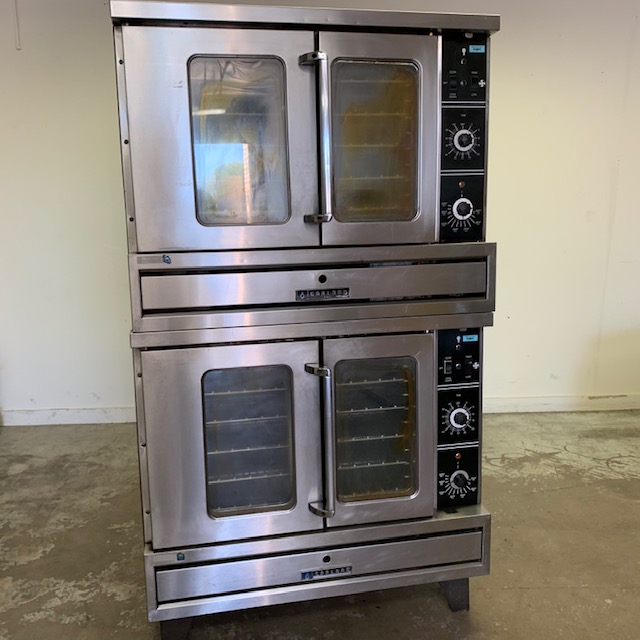
Find the location of a particular element. oven doors is located at coordinates (307, 425), (349, 422), (294, 154), (342, 148).